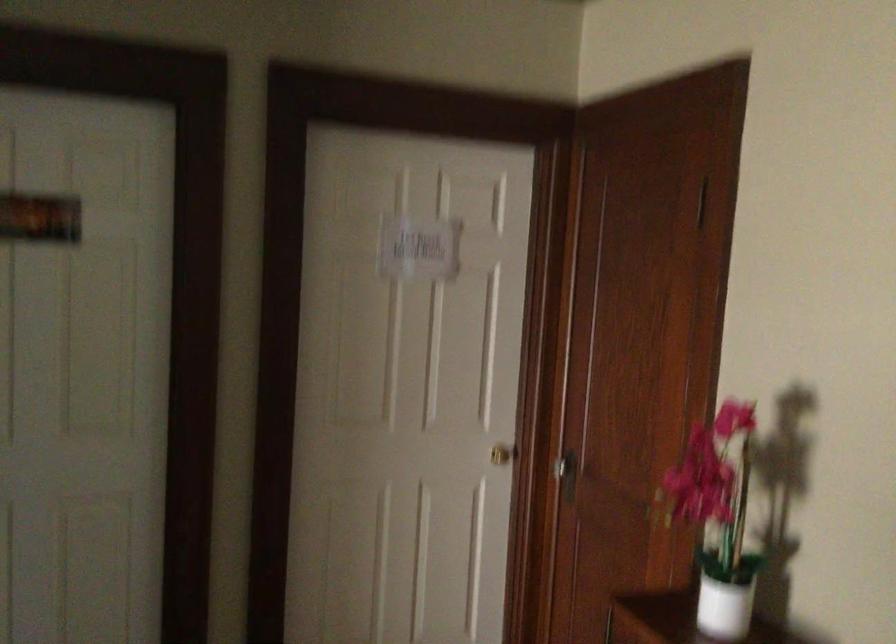
Locate an element on the screen. gold door knob is located at coordinates [x=503, y=453].